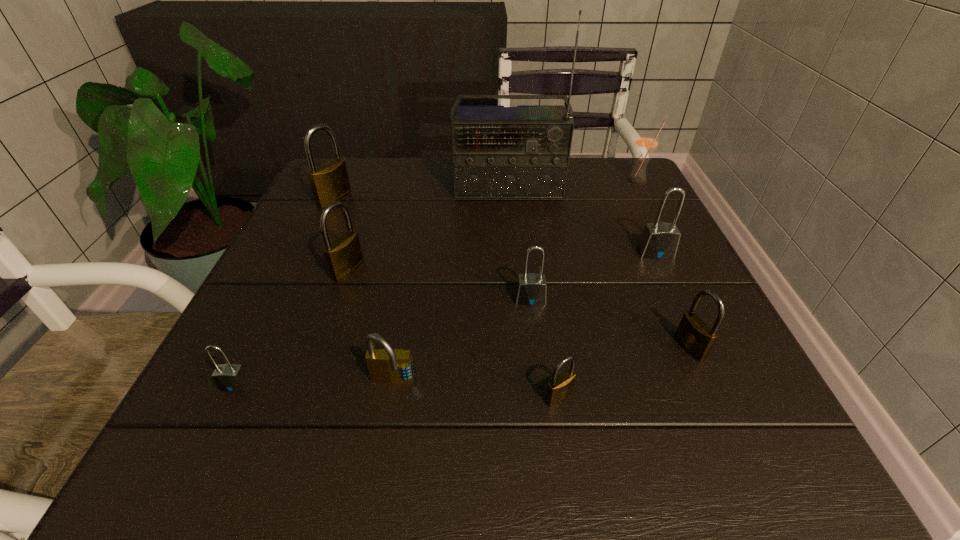
Locate an element on the screen. vacant area located 0.160m on the front of the straw is located at coordinates (660, 226).

At what (x,y) coordinates should I click in order to perform the action: click on free location located on the shackle of the biggest gray padlock. Please return your answer as a coordinate pair (x, y). Looking at the image, I should click on (686, 320).

The image size is (960, 540). I want to click on blank space located on the front of the third padlock from left to right, so click(x=316, y=367).

What are the coordinates of `vacant space located on the shackle of the second smallest gray padlock` in the screenshot? It's located at (545, 420).

You are a GUI agent. You are given a task and a screenshot of the screen. Output one action in this format:
    pyautogui.click(x=<x>, y=<y>)
    Task: Click on the vacant region located 0.370m on the back of the fourth nearest object
    This screenshot has height=540, width=960.
    Given the screenshot: What is the action you would take?
    pyautogui.click(x=628, y=210)

Identify the location of free space located 0.060m on the side with the combination dials of the fifth padlock from right to left. This screenshot has height=540, width=960. (384, 434).

I want to click on vacant space situated 0.080m on the shackle of the leftmost gray padlock, so click(206, 444).

You are a GUI agent. You are given a task and a screenshot of the screen. Output one action in this format:
    pyautogui.click(x=<x>, y=<y>)
    Task: Click on the free space located on the left of the second brass padlock from right to left
    The width and height of the screenshot is (960, 540).
    Given the screenshot: What is the action you would take?
    pyautogui.click(x=510, y=397)

Identify the location of radio receiver situated at the far edge. (498, 152).

This screenshot has width=960, height=540. Find the location of `padlock located in the far edge section of the desktop`. padlock located in the far edge section of the desktop is located at coordinates (329, 182).